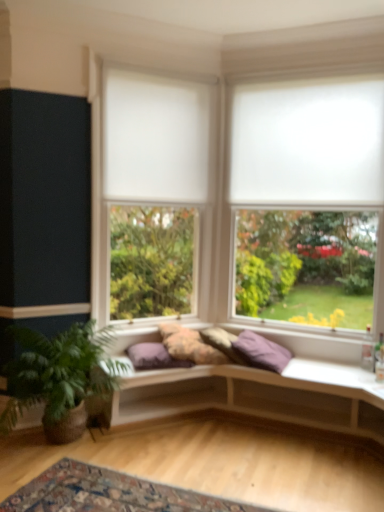
Where is `empty space that is ontop of white matte blind at upper right`? Image resolution: width=384 pixels, height=512 pixels. empty space that is ontop of white matte blind at upper right is located at coordinates (305, 74).